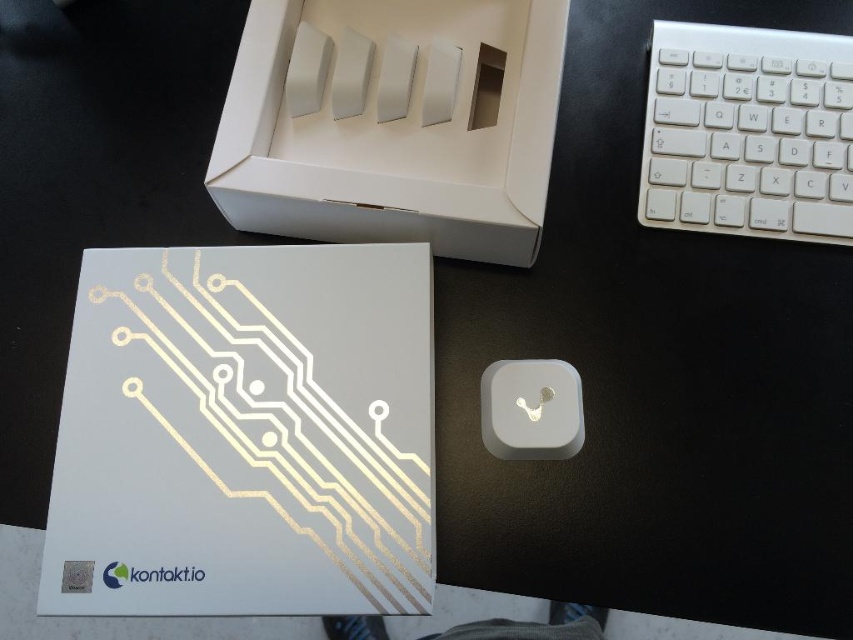
You are organizing the contents of the box and need to place the white matte box at upper center and the white plastic keyboard at upper right. Which object is located below the other?

The white matte box at upper center is positioned under the white plastic keyboard at upper right, so it is located below the keyboard.

You are organizing a tech showcase and need to place the white matte box at upper center and the white matte mouse at center on a table. Based on the image, which object should you place first to ensure proper alignment?

The white matte box at upper center should be placed first since it is positioned above the white matte mouse at center in the image, ensuring alignment.

You are holding a smartphone and want to take a closeup photo of the white plastic keyboard at upper right. The smartphone can focus on objects up to 28 inches away. Can you take the photo without moving the keyboard?

The white plastic keyboard at upper right is 29.31 inches away from the viewer, which is beyond the smartphone camera focus range of 28 inches. Therefore, you cannot take the photo without moving the keyboard closer.